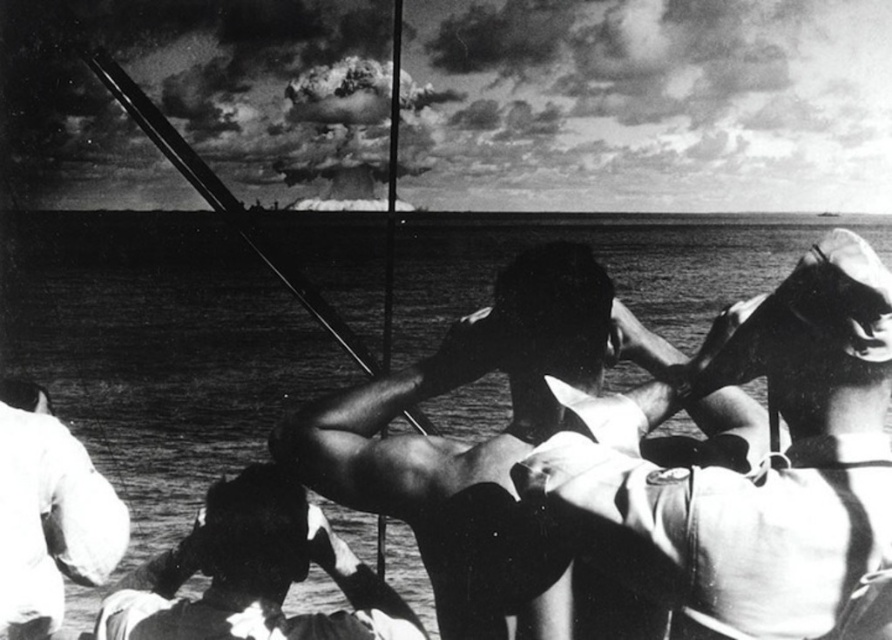
Question: Does smooth skin man at center appear on the left side of dark skin man at center?

Choices:
 (A) no
 (B) yes

Answer: (A)

Question: Among these objects, which one is farthest from the camera?

Choices:
 (A) dark skin man at center
 (B) white matte uniform at lower left
 (C) metallic gray boat at upper right
 (D) smooth skin man at center

Answer: (C)

Question: Considering the relative positions of dark skin man at center and white matte uniform at lower left in the image provided, where is dark skin man at center located with respect to white matte uniform at lower left?

Choices:
 (A) above
 (B) below

Answer: (A)

Question: Which of the following is the closest to the observer?

Choices:
 (A) (831, 214)
 (B) (38, 596)
 (C) (571, 474)
 (D) (780, 337)

Answer: (C)

Question: Estimate the real-world distances between objects in this image. Which object is closer to the smooth water at center?

Choices:
 (A) smooth skin man at center
 (B) dark skin man at center
 (C) white matte uniform at lower left
 (D) metallic gray boat at upper right

Answer: (A)

Question: Does white matte uniform at lower left appear over metallic gray boat at upper right?

Choices:
 (A) yes
 (B) no

Answer: (B)